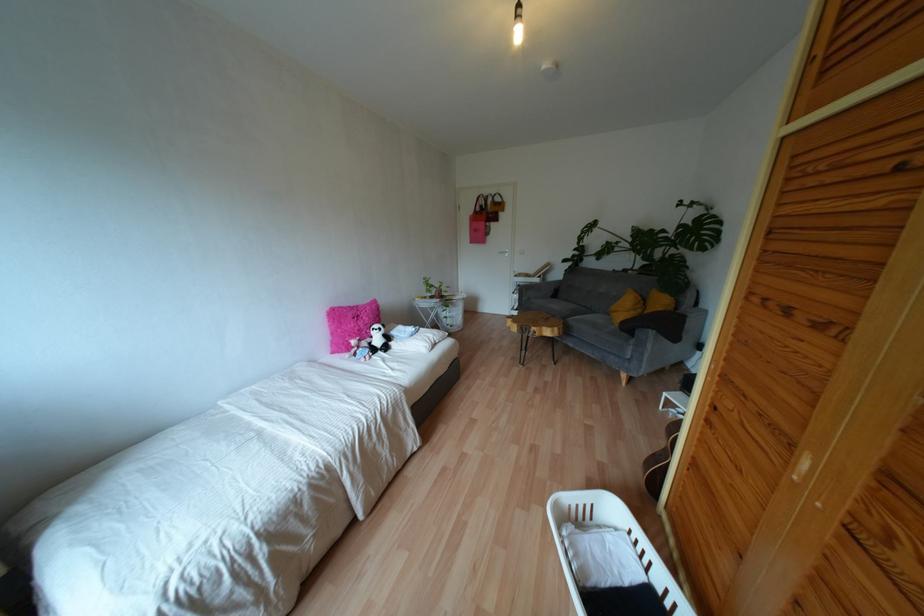
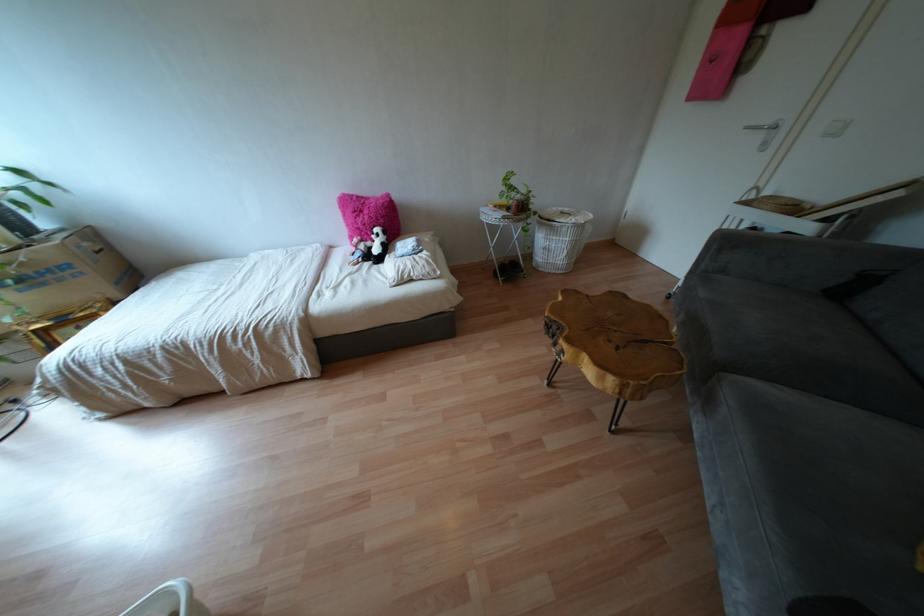
Question: I am providing you with two images of the same scene from different viewpoints. After the viewpoint changes to image2, which objects are now occluded?

Choices:
 (A) pink fluffy pillow
 (B) small plant pot
 (C) sofa sitting surface
 (D) none of these

Answer: (D)